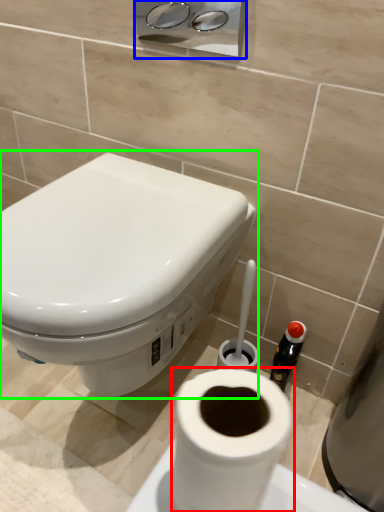
Question: Considering the real-world distances, which object is closest to toilet paper (highlighted by a red box)? dispenser (highlighted by a blue box) or toilet (highlighted by a green box).

Choices:
 (A) dispenser
 (B) toilet

Answer: (B)